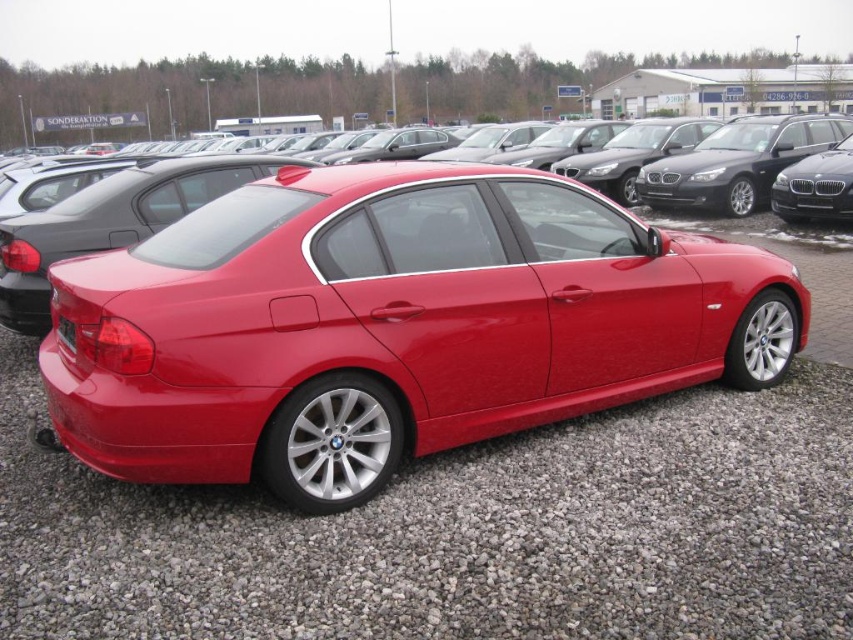
You are a delivery person trying to determine if a small package can fit in the trunk of the glossy metallic sedan at center without blocking the black plastic license plate at rear. Can you confirm if the sedan is taller than the license plate?

The glossy metallic sedan at center is taller than black plastic license plate at rear, so the sedan is taller. Therefore, the package can be placed in the trunk without blocking the license plate as long as it doesn not exceed the sedan height.

From the picture: You are a photographer trying to capture the glossy metallic sedan at center and the red gravel at lower center in a single shot. Which object will appear larger in the photo?

The glossy metallic sedan at center will appear larger in the photo because it is closer to the viewer than the red gravel at lower center.